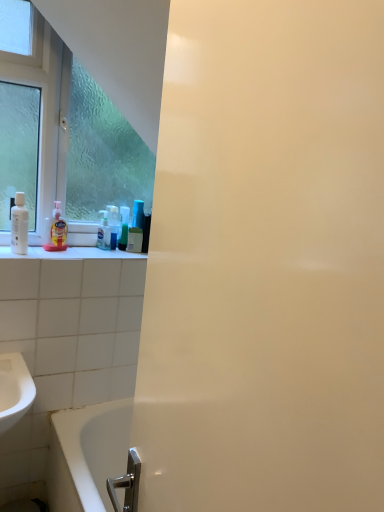
What are the coordinates of `white glossy bathtub at lower left` in the screenshot? It's located at (87, 455).

In order to face translucent plastic soap dispenser at left, which ranks as the first cleaning product in left-to-right order, should I rotate leftwards or rightwards?

You should rotate left by 17.673 degrees.

Describe the element at coordinates (64, 134) in the screenshot. I see `clear glass window at upper left` at that location.

You are a GUI agent. You are given a task and a screenshot of the screen. Output one action in this format:
    pyautogui.click(x=<x>, y=<y>)
    Task: Click on the white glossy bottle at left, the second mouthwash from the right
    Image resolution: width=384 pixels, height=512 pixels.
    Given the screenshot: What is the action you would take?
    pyautogui.click(x=19, y=225)

Locate an element on the screen. This screenshot has height=512, width=384. white glossy bathtub at lower left is located at coordinates (87, 455).

Consider the image. Is translucent plastic mouthwash at center, the second mouthwash in the left-to-right sequence, taller or shorter than translucent plastic soap dispenser at left, which ranks as the first cleaning product in left-to-right order?

Considering their sizes, translucent plastic mouthwash at center, the second mouthwash in the left-to-right sequence, has more height than translucent plastic soap dispenser at left, which ranks as the first cleaning product in left-to-right order.

How much distance is there between translucent plastic mouthwash at center, the second mouthwash in the left-to-right sequence, and translucent plastic soap dispenser at left, which ranks as the first cleaning product in left-to-right order?

A distance of 11.56 inches exists between translucent plastic mouthwash at center, the second mouthwash in the left-to-right sequence, and translucent plastic soap dispenser at left, which ranks as the first cleaning product in left-to-right order.

Could you tell me if translucent plastic mouthwash at center, the second mouthwash in the left-to-right sequence, is turned towards translucent plastic soap dispenser at left, placed as the 2th cleaning product when sorted from right to left?

No, translucent plastic mouthwash at center, the second mouthwash in the left-to-right sequence, is not aimed at translucent plastic soap dispenser at left, placed as the 2th cleaning product when sorted from right to left.

Where is `mouthwash on the right side of translucent plastic soap dispenser at left, marked as the first cleaning product in a front-to-back arrangement`? The image size is (384, 512). mouthwash on the right side of translucent plastic soap dispenser at left, marked as the first cleaning product in a front-to-back arrangement is located at coordinates (136, 228).

Is translucent plastic bottle at center, marked as the 2th cleaning product in a left-to-right arrangement, not close to translucent plastic soap dispenser at left, the 2th cleaning product viewed from the back?

translucent plastic bottle at center, marked as the 2th cleaning product in a left-to-right arrangement, is near translucent plastic soap dispenser at left, the 2th cleaning product viewed from the back, not far away.

From a real-world perspective, is translucent plastic bottle at center, the 1th cleaning product in the right-to-left sequence, physically located above or below translucent plastic soap dispenser at left, which ranks as the first cleaning product in left-to-right order?

In terms of real-world spatial position, translucent plastic bottle at center, the 1th cleaning product in the right-to-left sequence, is below translucent plastic soap dispenser at left, which ranks as the first cleaning product in left-to-right order.

How different are the orientations of translucent plastic bottle at center, marked as the 2th cleaning product in a left-to-right arrangement, and translucent plastic soap dispenser at left, which ranks as the first cleaning product in left-to-right order, in degrees?

There is a 0.000694-degree angle between the facing directions of translucent plastic bottle at center, marked as the 2th cleaning product in a left-to-right arrangement, and translucent plastic soap dispenser at left, which ranks as the first cleaning product in left-to-right order.

Does translucent plastic soap dispenser at left, marked as the first cleaning product in a front-to-back arrangement, turn towards clear glass window at upper left?

No.

Locate an element on the screen. This screenshot has height=512, width=384. cleaning product located on the left of clear glass window at upper left is located at coordinates (56, 231).

Measure the distance between translucent plastic soap dispenser at left, placed as the 2th cleaning product when sorted from right to left, and clear glass window at upper left.

translucent plastic soap dispenser at left, placed as the 2th cleaning product when sorted from right to left, is 12.49 inches from clear glass window at upper left.

Which object is wider, translucent plastic soap dispenser at left, the 2th cleaning product viewed from the back, or clear glass window at upper left?

Wider between the two is clear glass window at upper left.

Which object is more forward, translucent plastic soap dispenser at left, which ranks as the first cleaning product in left-to-right order, or translucent plastic bottle at center, the 1th cleaning product positioned from the back?

translucent plastic soap dispenser at left, which ranks as the first cleaning product in left-to-right order, is closer to the camera.

From the image's perspective, between translucent plastic soap dispenser at left, the 2th cleaning product viewed from the back, and translucent plastic bottle at center, the 1th cleaning product positioned from the back, who is located below?

translucent plastic bottle at center, the 1th cleaning product positioned from the back, appears lower in the image.

Would you say translucent plastic bottle at center, marked as the 2th cleaning product in a left-to-right arrangement, is part of translucent plastic soap dispenser at left, placed as the 2th cleaning product when sorted from right to left,'s contents?

Actually, translucent plastic bottle at center, marked as the 2th cleaning product in a left-to-right arrangement, is outside translucent plastic soap dispenser at left, placed as the 2th cleaning product when sorted from right to left.

You are a GUI agent. You are given a task and a screenshot of the screen. Output one action in this format:
    pyautogui.click(x=<x>, y=<y>)
    Task: Click on the cleaning product on the right of the translucent plastic soap dispenser at left, placed as the 2th cleaning product when sorted from right to left
    
    Given the screenshot: What is the action you would take?
    pyautogui.click(x=103, y=232)

Looking at this image, how far apart are translucent plastic bottle at center, marked as the 2th cleaning product in a left-to-right arrangement, and white glossy bathtub at lower left?

The distance of translucent plastic bottle at center, marked as the 2th cleaning product in a left-to-right arrangement, from white glossy bathtub at lower left is 31.27 inches.

Which point is more distant from viewer, (x=103, y=216) or (x=103, y=431)?

The point (x=103, y=216) is behind.

From the image's perspective, between translucent plastic bottle at center, marked as the 2th cleaning product in a left-to-right arrangement, and white glossy bathtub at lower left, who is located below?

white glossy bathtub at lower left is shown below in the image.

Is translucent plastic bottle at center, the 1th cleaning product positioned from the back, in front of or behind white glossy bathtub at lower left in the image?

Clearly, translucent plastic bottle at center, the 1th cleaning product positioned from the back, is behind white glossy bathtub at lower left.

Can you confirm if white glossy bottle at left, which is the 2th mouthwash from back to front, is wider than translucent plastic mouthwash at center, the second mouthwash in the left-to-right sequence?

Indeed, white glossy bottle at left, which is the 2th mouthwash from back to front, has a greater width compared to translucent plastic mouthwash at center, the second mouthwash in the left-to-right sequence.

From a real-world perspective, between white glossy bottle at left, which is the 2th mouthwash from back to front, and translucent plastic mouthwash at center, the 2th mouthwash in the front-to-back sequence, who is vertically lower?

translucent plastic mouthwash at center, the 2th mouthwash in the front-to-back sequence, is physically lower.

Is translucent plastic mouthwash at center, the 2th mouthwash in the front-to-back sequence, completely or partially inside white glossy bottle at left, which is the 2th mouthwash from back to front?

No.

Based on the photo, from the image's perspective, is white glossy bottle at left, which is the 2th mouthwash from back to front, on top of translucent plastic mouthwash at center, which is the 1th mouthwash in right-to-left order?

No, from the image's perspective, white glossy bottle at left, which is the 2th mouthwash from back to front, is not above translucent plastic mouthwash at center, which is the 1th mouthwash in right-to-left order.

In terms of width, does clear glass window at upper left look wider or thinner when compared to translucent plastic soap dispenser at left, placed as the 2th cleaning product when sorted from right to left?

Considering their sizes, clear glass window at upper left looks broader than translucent plastic soap dispenser at left, placed as the 2th cleaning product when sorted from right to left.

Can you confirm if clear glass window at upper left is positioned to the right of translucent plastic soap dispenser at left, placed as the 2th cleaning product when sorted from right to left?

Yes.

From the image's perspective, which one is positioned lower, clear glass window at upper left or translucent plastic soap dispenser at left, which ranks as the first cleaning product in left-to-right order?

translucent plastic soap dispenser at left, which ranks as the first cleaning product in left-to-right order, from the image's perspective.

Find the location of a particular element. cleaning product that is the 1st object directly below the translucent plastic mouthwash at center, which ranks as the 1th mouthwash in back-to-front order (from a real-world perspective) is located at coordinates (56, 231).

This screenshot has width=384, height=512. Find the location of `cleaning product in front of the translucent plastic bottle at center, the 1th cleaning product in the right-to-left sequence`. cleaning product in front of the translucent plastic bottle at center, the 1th cleaning product in the right-to-left sequence is located at coordinates (x=56, y=231).

From the picture: From the image, which object appears to be farther from white glossy bathtub at lower left, white glossy bottle at left, which is the 2th mouthwash from back to front, or translucent plastic bottle at center, which is the second cleaning product in front-to-back order?

The object further to white glossy bathtub at lower left is translucent plastic bottle at center, which is the second cleaning product in front-to-back order.

Based on their spatial positions, is clear glass window at upper left or translucent plastic bottle at center, marked as the 2th cleaning product in a left-to-right arrangement, closer to translucent plastic mouthwash at center, the second mouthwash in the left-to-right sequence?

The object closer to translucent plastic mouthwash at center, the second mouthwash in the left-to-right sequence, is translucent plastic bottle at center, marked as the 2th cleaning product in a left-to-right arrangement.

When comparing their distances from translucent plastic soap dispenser at left, placed as the 2th cleaning product when sorted from right to left, does clear glass window at upper left or white glossy bathtub at lower left seem further?

white glossy bathtub at lower left.

Estimate the real-world distances between objects in this image. Which object is further from white glossy bathtub at lower left, translucent plastic bottle at center, the 1th cleaning product positioned from the back, or white glossy bottle at left, which is the 2th mouthwash from back to front?

translucent plastic bottle at center, the 1th cleaning product positioned from the back, is positioned further to the anchor white glossy bathtub at lower left.

From the image, which object appears to be nearer to translucent plastic bottle at center, the 1th cleaning product positioned from the back, white glossy bathtub at lower left or translucent plastic mouthwash at center, which is the 1th mouthwash in right-to-left order?

The object closer to translucent plastic bottle at center, the 1th cleaning product positioned from the back, is translucent plastic mouthwash at center, which is the 1th mouthwash in right-to-left order.

Looking at the image, which one is located closer to clear glass window at upper left, white glossy bottle at left, the 1th mouthwash from the left, or translucent plastic soap dispenser at left, the 2th cleaning product viewed from the back?

The object closer to clear glass window at upper left is translucent plastic soap dispenser at left, the 2th cleaning product viewed from the back.

Which object lies nearer to the anchor point clear glass window at upper left, translucent plastic mouthwash at center, which ranks as the 1th mouthwash in back-to-front order, or translucent plastic soap dispenser at left, marked as the first cleaning product in a front-to-back arrangement?

translucent plastic soap dispenser at left, marked as the first cleaning product in a front-to-back arrangement.

Considering their positions, is white glossy bathtub at lower left positioned closer to white glossy bottle at left, the 1th mouthwash from the left, than translucent plastic bottle at center, which is the second cleaning product in front-to-back order?

translucent plastic bottle at center, which is the second cleaning product in front-to-back order, is closer to white glossy bottle at left, the 1th mouthwash from the left.

Locate an element on the screen. cleaning product between white glossy bottle at left, the 1th mouthwash from the left, and translucent plastic bottle at center, the 1th cleaning product in the right-to-left sequence is located at coordinates (56, 231).

Identify the location of cleaning product located between translucent plastic soap dispenser at left, placed as the 2th cleaning product when sorted from right to left, and translucent plastic mouthwash at center, which is the 1th mouthwash in right-to-left order, in the left-right direction. The image size is (384, 512). (103, 232).

I want to click on cleaning product between clear glass window at upper left and translucent plastic bottle at center, which is the second cleaning product in front-to-back order, from top to bottom, so click(x=56, y=231).

This screenshot has width=384, height=512. In order to click on cleaning product between translucent plastic soap dispenser at left, placed as the 2th cleaning product when sorted from right to left, and white glossy bathtub at lower left vertically in this screenshot , I will do `click(103, 232)`.